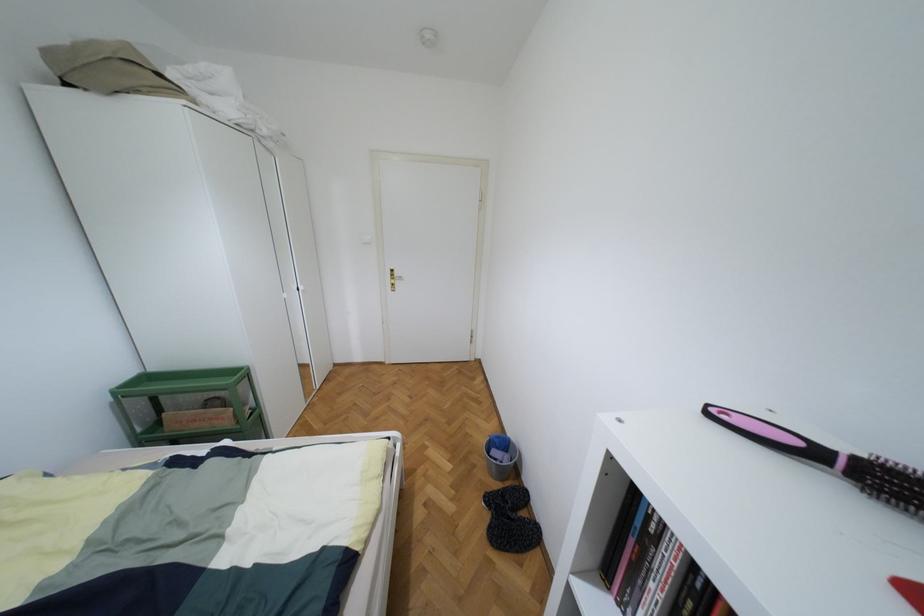
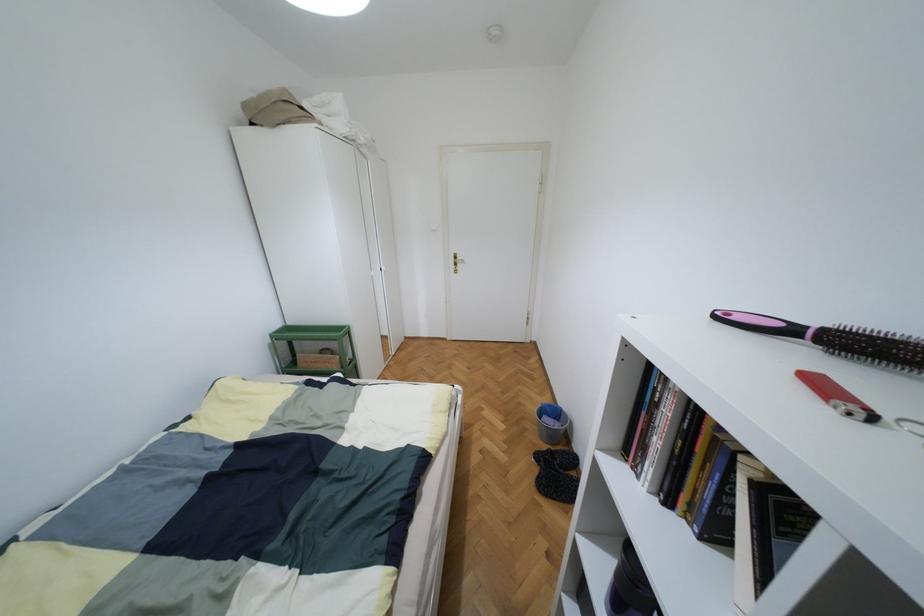
Where in the second image is the point corresponding to [496,437] from the first image?

(549, 406)